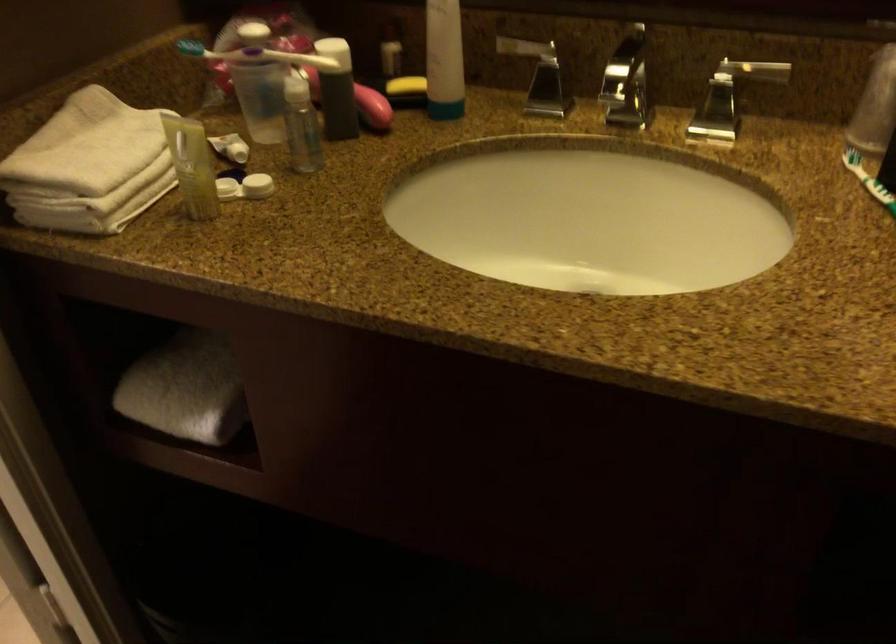
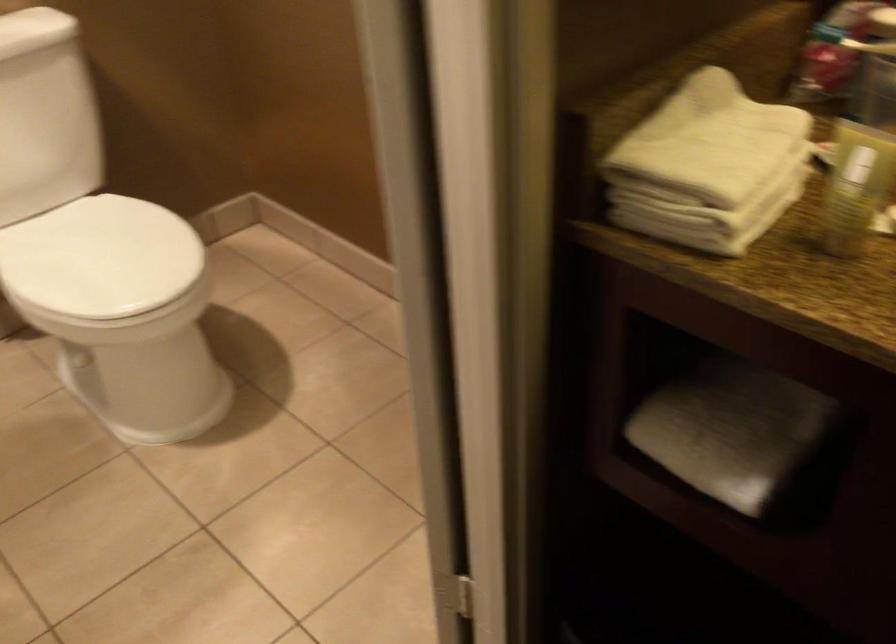
In the second image, find the point that corresponds to point 75,207 in the first image.

(704, 219)